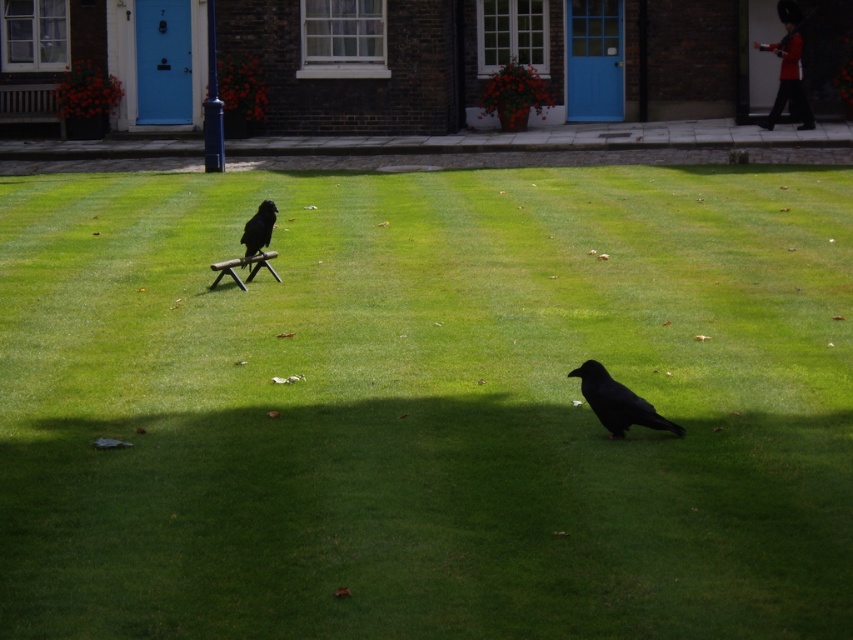
Which is more to the right, shiny black crow at lower right or black matte bird at center?

shiny black crow at lower right is more to the right.

Is shiny black crow at lower right above black matte bird at center?

Actually, shiny black crow at lower right is below black matte bird at center.

Who is more distant from viewer, (612, 410) or (257, 230)?

Point (257, 230)

Image resolution: width=853 pixels, height=640 pixels. Identify the location of shiny black crow at lower right. (618, 403).

Does point (73, 440) lie behind point (643, 413)?

Yes, it is.

Which of these two, green grass at center or shiny black crow at lower right, stands shorter?

Standing shorter between the two is shiny black crow at lower right.

Is point (299, 362) in front of point (595, 404)?

No, (299, 362) is further to viewer.

You are a GUI agent. You are given a task and a screenshot of the screen. Output one action in this format:
    pyautogui.click(x=<x>, y=<y>)
    Task: Click on the green grass at center
    
    Given the screenshot: What is the action you would take?
    pyautogui.click(x=426, y=404)

Who is more forward, (235, 422) or (248, 250)?

Positioned in front is point (235, 422).

Between green grass at center and black matte bird at center, which one appears on the right side from the viewer's perspective?

green grass at center is more to the right.

Identify the location of green grass at center. The width and height of the screenshot is (853, 640). (426, 404).